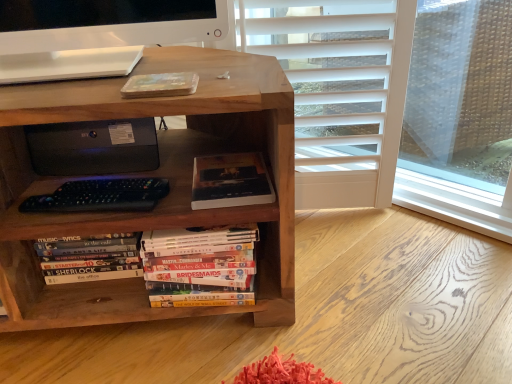
Question: Considering the relative sizes of wooden bookcase at center and hardcover books at lower left, the 2th book when ordered from right to left, in the image provided, is wooden bookcase at center shorter than hardcover books at lower left, the 2th book when ordered from right to left,?

Choices:
 (A) yes
 (B) no

Answer: (B)

Question: Is wooden bookcase at center thinner than hardcover books at lower left, positioned as the 2th book in top-to-bottom order?

Choices:
 (A) no
 (B) yes

Answer: (A)

Question: Can you confirm if wooden bookcase at center is positioned to the right of hardcover books at lower left, arranged as the first book when viewed from the left?

Choices:
 (A) yes
 (B) no

Answer: (B)

Question: Is wooden bookcase at center at the left side of hardcover books at lower left, positioned as the 2th book in top-to-bottom order?

Choices:
 (A) no
 (B) yes

Answer: (B)

Question: Is wooden bookcase at center facing away from hardcover books at lower left, positioned as the 2th book in top-to-bottom order?

Choices:
 (A) yes
 (B) no

Answer: (A)

Question: From the image's perspective, is dark matte book at center, the first book positioned from the top, located above or below hardcover books at lower left, arranged as the first book when viewed from the left?

Choices:
 (A) below
 (B) above

Answer: (B)

Question: From a real-world perspective, is dark matte book at center, placed as the second book when sorted from left to right, above or below hardcover books at lower left, arranged as the first book when viewed from the left?

Choices:
 (A) above
 (B) below

Answer: (A)

Question: Is dark matte book at center, positioned as the first book in right-to-left order, bigger or smaller than hardcover books at lower left, which is the first book in bottom-to-top order?

Choices:
 (A) small
 (B) big

Answer: (A)

Question: Considering the positions of dark matte book at center, placed as the second book when sorted from left to right, and hardcover books at lower left, arranged as the first book when viewed from the left, in the image, is dark matte book at center, placed as the second book when sorted from left to right, wider or thinner than hardcover books at lower left, arranged as the first book when viewed from the left,?

Choices:
 (A) thin
 (B) wide

Answer: (B)

Question: Do you think hardcover books at lower left, which is the first book in bottom-to-top order, is within wooden bookcase at center, or outside of it?

Choices:
 (A) inside
 (B) outside

Answer: (A)

Question: Would you say hardcover books at lower left, positioned as the 2th book in top-to-bottom order, is to the left or to the right of wooden bookcase at center in the picture?

Choices:
 (A) right
 (B) left

Answer: (A)

Question: In the image, is hardcover books at lower left, positioned as the 2th book in top-to-bottom order, positioned in front of or behind wooden bookcase at center?

Choices:
 (A) front
 (B) behind

Answer: (B)

Question: Looking at the image, does hardcover books at lower left, positioned as the 2th book in top-to-bottom order, seem bigger or smaller compared to wooden bookcase at center?

Choices:
 (A) big
 (B) small

Answer: (B)

Question: Based on their sizes in the image, would you say black matte printer at center is bigger or smaller than hardcover books at lower left, positioned as the 2th book in top-to-bottom order?

Choices:
 (A) small
 (B) big

Answer: (B)

Question: Relative to hardcover books at lower left, which is the first book in bottom-to-top order, is black matte printer at center in front or behind?

Choices:
 (A) front
 (B) behind

Answer: (A)